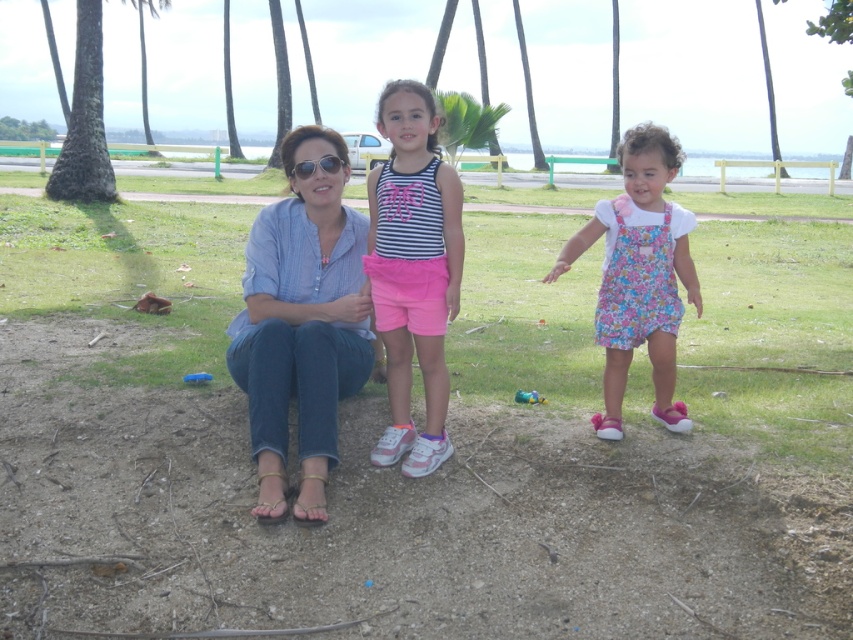
Is the position of green leafy palm tree at upper center more distant than that of matte black sunglasses at center?

Yes, it is.

Who is more forward, (142, 16) or (294, 173)?

Point (294, 173) is in front.

Identify the location of green leafy palm tree at upper center. (144, 56).

Is denim shirt at center thinner than floral fabric dress at right?

Correct, denim shirt at center's width is less than floral fabric dress at right's.

Based on the photo, can you confirm if denim shirt at center is wider than floral fabric dress at right?

No, denim shirt at center is not wider than floral fabric dress at right.

Locate an element on the screen. The width and height of the screenshot is (853, 640). denim shirt at center is located at coordinates (300, 324).

The image size is (853, 640). Identify the location of denim shirt at center. (300, 324).

Can you confirm if striped fabric tank top at center is thinner than floral fabric dress at right?

Indeed, striped fabric tank top at center has a lesser width compared to floral fabric dress at right.

Is point (407, 243) more distant than point (653, 275)?

That is False.

This screenshot has width=853, height=640. Find the location of `striped fabric tank top at center`. striped fabric tank top at center is located at coordinates (413, 269).

This screenshot has height=640, width=853. I want to click on striped fabric tank top at center, so (413, 269).